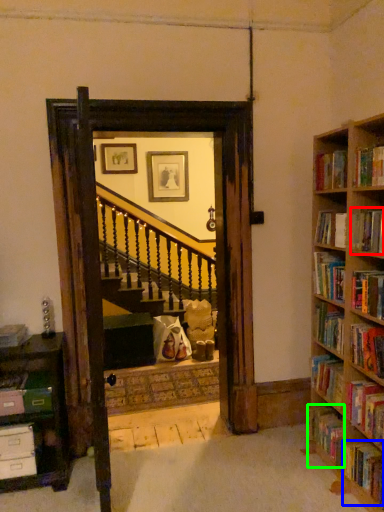
Question: Which is nearer to the book (highlighted by a red box)? book (highlighted by a blue box) or book (highlighted by a green box).

Choices:
 (A) book
 (B) book

Answer: (A)